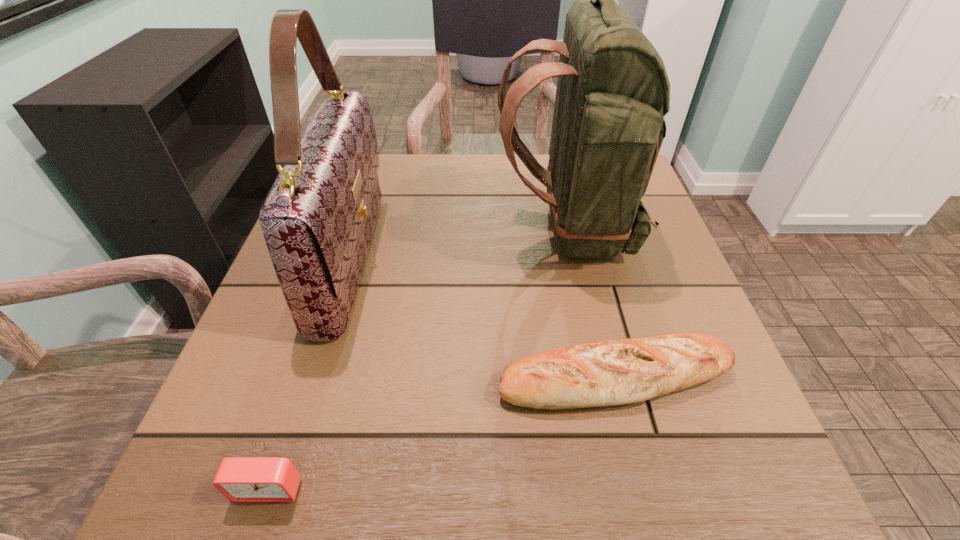
Where is `handbag`? handbag is located at coordinates (318, 218).

Where is `backpack`? This screenshot has height=540, width=960. backpack is located at coordinates (613, 91).

At what (x,y) coordinates should I click in order to perform the action: click on baguet. Please return your answer as a coordinate pair (x, y). Looking at the image, I should click on (611, 372).

Locate an element on the screen. This screenshot has width=960, height=540. alarm clock is located at coordinates (240, 479).

Find the location of a particular element. free space located 0.380m on the front of the handbag with the clasp is located at coordinates (569, 259).

The width and height of the screenshot is (960, 540). In order to click on blank space located 0.370m on the back of the backpack in this screenshot , I will do `click(321, 228)`.

I want to click on vacant area located 0.200m on the back of the backpack, so click(401, 228).

You are a GUI agent. You are given a task and a screenshot of the screen. Output one action in this format:
    pyautogui.click(x=<x>, y=<y>)
    Task: Click on the free space located on the back of the backpack
    Image resolution: width=960 pixels, height=540 pixels.
    Given the screenshot: What is the action you would take?
    pyautogui.click(x=307, y=228)

Where is `free location located 0.220m on the left of the baguet`? This screenshot has width=960, height=540. free location located 0.220m on the left of the baguet is located at coordinates (354, 378).

Where is `handbag that is positioned at the far edge`? handbag that is positioned at the far edge is located at coordinates (318, 218).